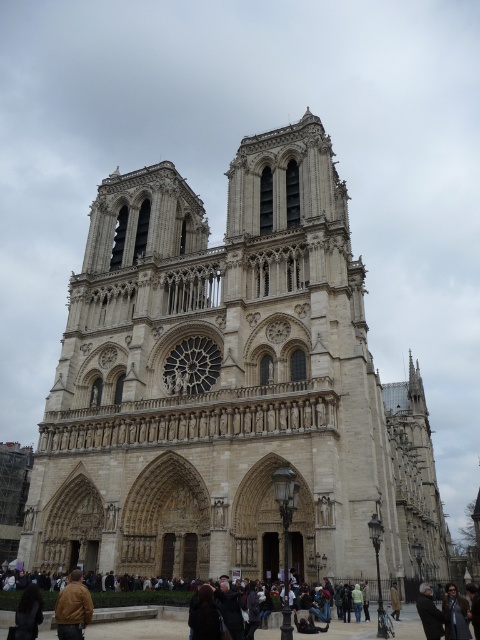
You are a tourist visiting Notre Dame Cathedral and want to take a photo of the cathedral facade. You have two coats with you, a dark gray coat at lower right and a brown wool coat at lower center. If you want to place both coats side by side in your photo, which coat should you choose if you need the one that takes up more horizontal space?

The dark gray coat at lower right should be chosen because its width surpasses that of the brown wool coat at lower center, making it the better option for taking up more horizontal space in the photo.

You are standing in front of the Notre Dame Cathedral and see the point marked at coordinates (430,612). What object at the lower right does this point indicate?

The point at coordinates (430,612) corresponds to the dark gray coat at lower right.

You are standing in front of the Notre Dame Cathedral and see a dark gray coat at lower right and a brown wool coat at lower center. Which coat is positioned higher on the cathedral facade?

The dark gray coat at lower right is positioned higher than the brown wool coat at lower center because it is above it.